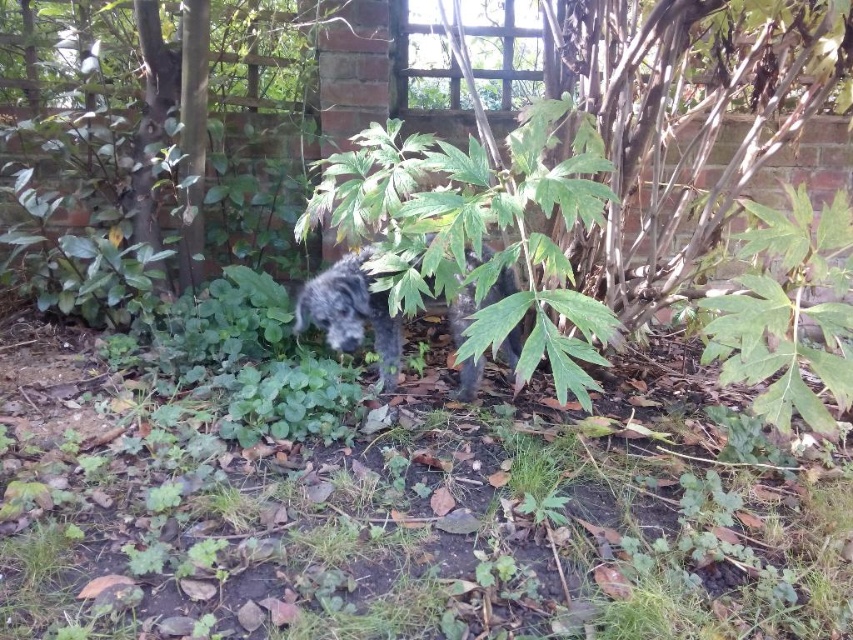
You are standing in the garden and want to take a photo of the shaggy gray dog at center without the green leafy plant at center right appearing in the frame. Which direction should you move to achieve this?

Move to the right side of the shaggy gray dog at center so that the green leafy plant at center right is out of the frame to the left.

Based on the photo, you are trying to decide which dog to adopt between the shaggy gray dog at center and the fuzzy black dog at center. Based on their sizes, which one is wider?

The shaggy gray dog at center might be wider than fuzzy black dog at center.

You are a photographer trying to capture a clear photo of the shaggy gray dog at center. However, the green leafy plant at center right is blocking your view. Can you move the plant to get a better shot?

The green leafy plant at center right is in front of the shaggy gray dog at center, so moving it would allow you to see the dog clearly.